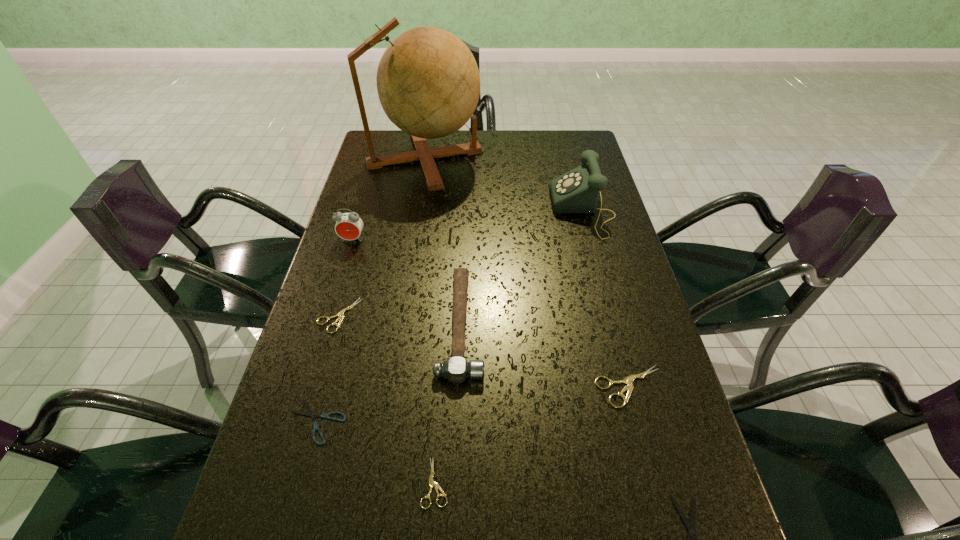
You are a GUI agent. You are given a task and a screenshot of the screen. Output one action in this format:
    pyautogui.click(x=<x>, y=<y>)
    Task: Click on the free point located on the front of the farthest beige shears
    
    Given the screenshot: What is the action you would take?
    pyautogui.click(x=294, y=474)

Locate an element on the screen. free region located 0.370m on the back of the smallest beige shears is located at coordinates [x=447, y=308].

You are a GUI agent. You are given a task and a screenshot of the screen. Output one action in this format:
    pyautogui.click(x=<x>, y=<y>)
    Task: Click on the vacant space located on the right of the left black shears
    
    Given the screenshot: What is the action you would take?
    pyautogui.click(x=396, y=421)

You are a GUI agent. You are given a task and a screenshot of the screen. Output one action in this format:
    pyautogui.click(x=<x>, y=<y>)
    Task: Click on the object positioned at the far edge
    
    Given the screenshot: What is the action you would take?
    pyautogui.click(x=428, y=82)

The image size is (960, 540). Identify the location of globe positioned at the left edge. (428, 82).

Identify the location of alarm clock that is at the left edge. The height and width of the screenshot is (540, 960). (348, 226).

Find the location of a particular element. The width and height of the screenshot is (960, 540). telephone that is at the right edge is located at coordinates (577, 191).

Locate an element on the screen. This screenshot has width=960, height=540. shears located at the right edge is located at coordinates (628, 380).

Identify the location of object at the far left corner. The image size is (960, 540). (428, 82).

Identify the location of free region at the right edge. (675, 484).